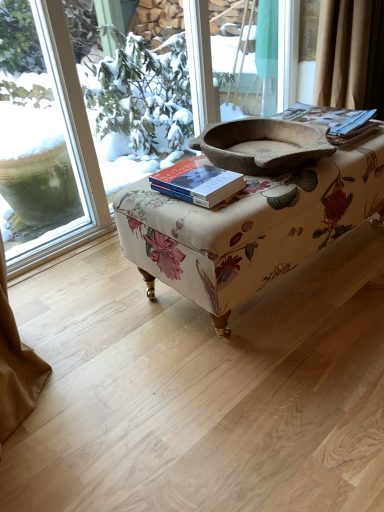
Question: Is matte brown book at upper right, acting as the first paperback book starting from the right, facing towards transparent glass window at upper left?

Choices:
 (A) yes
 (B) no

Answer: (B)

Question: Would you say matte brown book at upper right, the 2th paperback book ordered from the bottom, is outside transparent glass window at upper left?

Choices:
 (A) no
 (B) yes

Answer: (B)

Question: Can you confirm if matte brown book at upper right, the 2th paperback book ordered from the bottom, is bigger than transparent glass window at upper left?

Choices:
 (A) yes
 (B) no

Answer: (B)

Question: Is matte brown book at upper right, which is the 2th paperback book in left-to-right order, thinner than transparent glass window at upper left?

Choices:
 (A) yes
 (B) no

Answer: (A)

Question: Does matte brown book at upper right, the 2th paperback book ordered from the bottom, have a greater width compared to transparent glass window at upper left?

Choices:
 (A) yes
 (B) no

Answer: (B)

Question: From a real-world perspective, relative to floral fabric ottoman at center, is hardcover book at center, the first paperback book positioned from the front, vertically above or below?

Choices:
 (A) below
 (B) above

Answer: (B)

Question: Would you say hardcover book at center, the first paperback book positioned from the left, is inside or outside floral fabric ottoman at center?

Choices:
 (A) outside
 (B) inside

Answer: (A)

Question: Is hardcover book at center, which is the 2th paperback book in back-to-front order, wider or thinner than floral fabric ottoman at center?

Choices:
 (A) thin
 (B) wide

Answer: (A)

Question: Is point (200, 192) closer or farther from the camera than point (274, 229)?

Choices:
 (A) closer
 (B) farther

Answer: (A)

Question: From the image's perspective, relative to rustic wooden bowl at center, is transparent glass window at upper left above or below?

Choices:
 (A) below
 (B) above

Answer: (B)

Question: In terms of width, does transparent glass window at upper left look wider or thinner when compared to rustic wooden bowl at center?

Choices:
 (A) thin
 (B) wide

Answer: (A)

Question: Considering the positions of transparent glass window at upper left and rustic wooden bowl at center in the image, is transparent glass window at upper left bigger or smaller than rustic wooden bowl at center?

Choices:
 (A) big
 (B) small

Answer: (A)

Question: Does point (119, 109) appear closer or farther from the camera than point (264, 148)?

Choices:
 (A) closer
 (B) farther

Answer: (B)

Question: Based on their sizes in the image, would you say matte brown book at upper right, the 2th paperback book ordered from the bottom, is bigger or smaller than floral fabric ottoman at center?

Choices:
 (A) small
 (B) big

Answer: (A)

Question: Considering the relative positions of matte brown book at upper right, which is the 2th paperback book in left-to-right order, and floral fabric ottoman at center in the image provided, is matte brown book at upper right, which is the 2th paperback book in left-to-right order, to the left or to the right of floral fabric ottoman at center?

Choices:
 (A) left
 (B) right

Answer: (B)